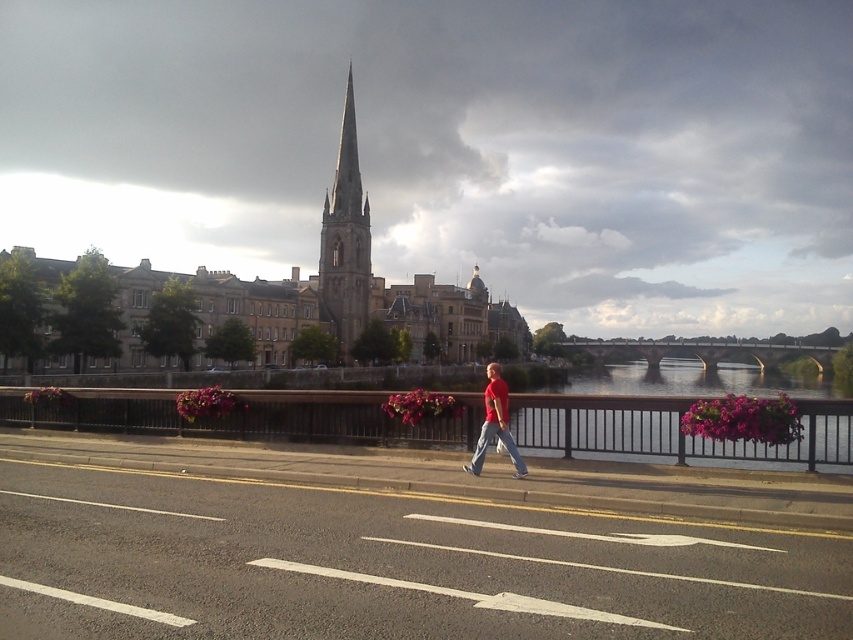
Between clear water at bridge right and matte red shirt at center, which one is positioned lower?

clear water at bridge right is below.

Is clear water at bridge right positioned at the back of matte red shirt at center?

No, clear water at bridge right is closer to the viewer.

Between point (637, 396) and point (469, 465), which one is positioned in front?

Point (469, 465) is in front.

Locate an element on the screen. The image size is (853, 640). clear water at bridge right is located at coordinates (672, 420).

Who is taller, smooth stone spire at center or matte red shirt at center?

With more height is smooth stone spire at center.

Which is in front, point (334, 275) or point (489, 362)?

Point (334, 275)

Find the location of a particular element. The width and height of the screenshot is (853, 640). smooth stone spire at center is located at coordinates (345, 241).

Can you confirm if clear water at bridge right is bigger than smooth stone spire at center?

Correct, clear water at bridge right is larger in size than smooth stone spire at center.

Is point (701, 452) closer to viewer compared to point (347, 236)?

Yes.

The height and width of the screenshot is (640, 853). In order to click on clear water at bridge right in this screenshot , I will do `click(672, 420)`.